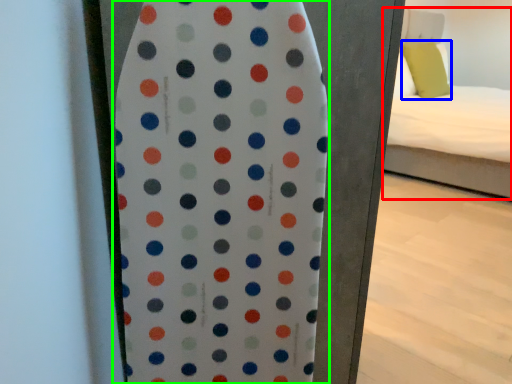
Question: Which object is positioned closest to bed (highlighted by a red box)? Select from pillow (highlighted by a blue box) and surfboard (highlighted by a green box).

Choices:
 (A) pillow
 (B) surfboard

Answer: (A)